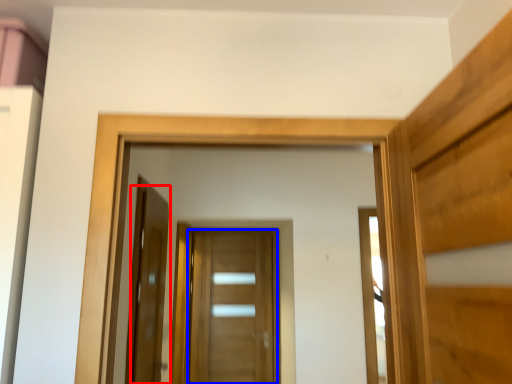
Question: Which point is closer to the camera, door (highlighted by a red box) or door (highlighted by a blue box)?

Choices:
 (A) door
 (B) door

Answer: (A)